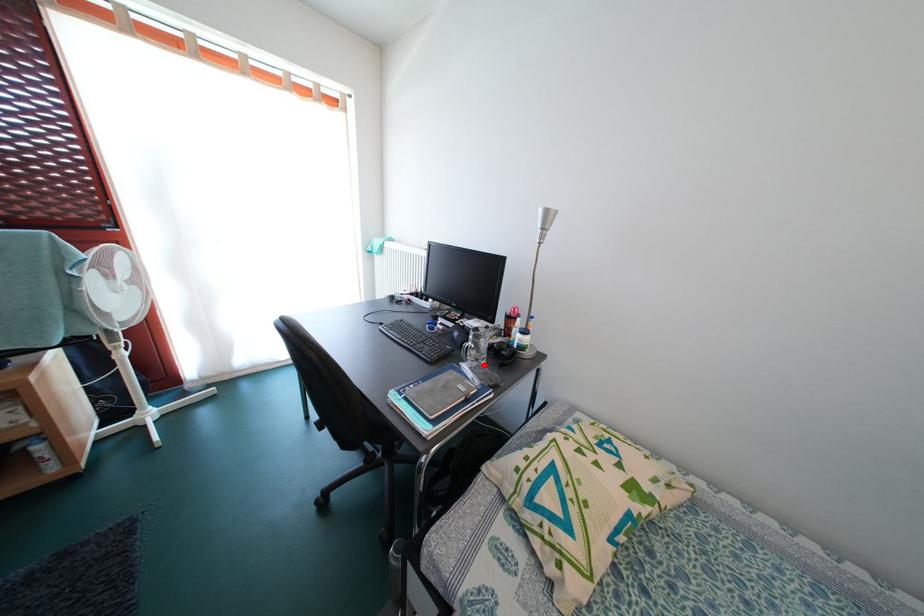
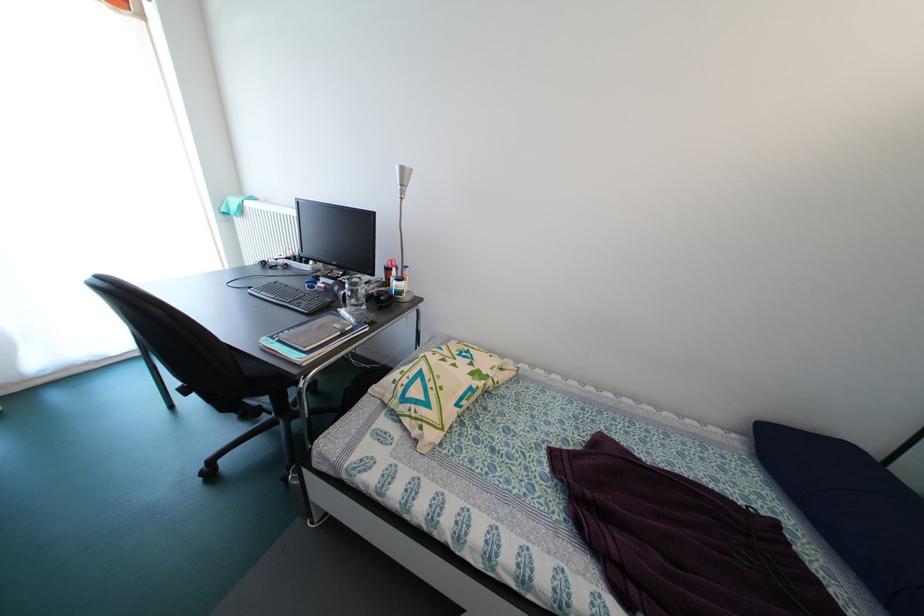
Find the pixel in the second image that matches the highlighted location in the first image.

(362, 310)